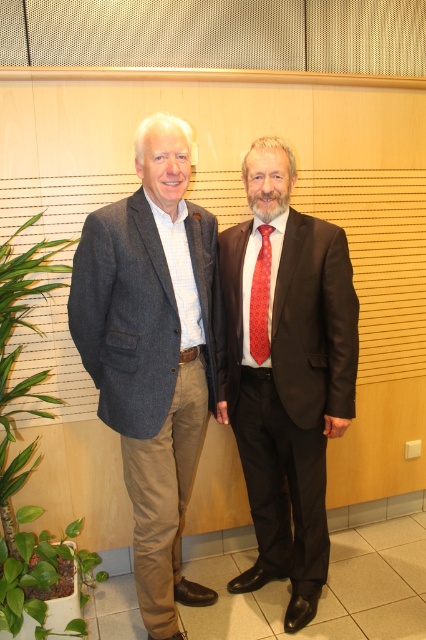
Question: Which object is the farthest from the green leafy plant at lower left?

Choices:
 (A) dark brown suit at center
 (B) gray woolen blazer at left

Answer: (A)

Question: Which point is closer to the camera?

Choices:
 (A) matte gray blazer at center
 (B) red silk tie at center
 (C) dark brown suit at center

Answer: (A)

Question: Is matte gray blazer at center below gray woolen blazer at left?

Choices:
 (A) no
 (B) yes

Answer: (A)

Question: Can you confirm if dark brown suit at center is wider than gray woolen blazer at left?

Choices:
 (A) no
 (B) yes

Answer: (A)

Question: Which of the following is the closest to the observer?

Choices:
 (A) (242, 580)
 (B) (135, 406)
 (C) (43, 579)
 (D) (259, 330)

Answer: (B)

Question: Can you confirm if matte gray blazer at center is positioned to the right of gray woolen blazer at left?

Choices:
 (A) yes
 (B) no

Answer: (A)